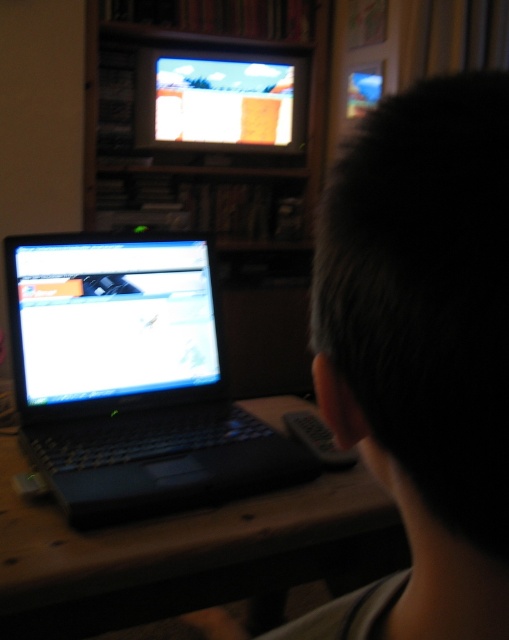
You are a person sitting at the desk and want to look at both the black matte laptop at left and the matte plastic television at upper center. Which object will require you to tilt your head upward more?

The matte plastic television at upper center will require tilting your head upward more because it is positioned above the black matte laptop at left.

From the picture: You are a photographer trying to capture a candid shot of the person working at the desk. The dark hair at center and the matte plastic television at upper center are both in your frame. Considering their widths, which object should you focus on to ensure the subject fills the frame better?

The matte plastic television at upper center has a greater width than the dark hair at center, so focusing on it would allow it to fill the frame better.